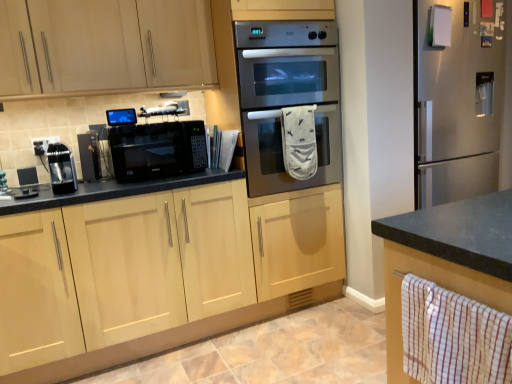
Question: From the image's perspective, is light wood cabinet at upper left, placed as the 1th cabinetry when sorted from top to bottom, over black plastic electric outlet at upper left?

Choices:
 (A) no
 (B) yes

Answer: (B)

Question: From the image's perspective, would you say light wood cabinet at upper left, which is counted as the 2th cabinetry, starting from the bottom, is shown under black plastic electric outlet at upper left?

Choices:
 (A) no
 (B) yes

Answer: (A)

Question: Can we say light wood cabinet at upper left, placed as the 1th cabinetry when sorted from top to bottom, lies outside black plastic electric outlet at upper left?

Choices:
 (A) no
 (B) yes

Answer: (B)

Question: Does light wood cabinet at upper left, which is counted as the 2th cabinetry, starting from the bottom, lie in front of black plastic electric outlet at upper left?

Choices:
 (A) yes
 (B) no

Answer: (A)

Question: Could you tell me if light wood cabinet at upper left, which is counted as the 2th cabinetry, starting from the bottom, is turned towards black plastic electric outlet at upper left?

Choices:
 (A) no
 (B) yes

Answer: (A)

Question: Visually, is white checkered hand towel at lower right, which is the 1th hand towel from bottom to top, positioned to the left or to the right of satin black coffee maker at left, placed as the 3th appliance when sorted from right to left?

Choices:
 (A) left
 (B) right

Answer: (B)

Question: From the image's perspective, relative to satin black coffee maker at left, acting as the first appliance starting from the left, is white checkered hand towel at lower right, the 2th hand towel from the top, above or below?

Choices:
 (A) below
 (B) above

Answer: (A)

Question: In terms of size, does white checkered hand towel at lower right, which is the second hand towel in back-to-front order, appear bigger or smaller than satin black coffee maker at left, placed as the 3th appliance when sorted from right to left?

Choices:
 (A) big
 (B) small

Answer: (A)

Question: Is white checkered hand towel at lower right, the first hand towel when ordered from right to left, inside the boundaries of satin black coffee maker at left, acting as the first appliance starting from the left, or outside?

Choices:
 (A) outside
 (B) inside

Answer: (A)

Question: Is satin black coffee maker at left, placed as the 3th appliance when sorted from right to left, taller or shorter than black matte coffee maker at left, positioned as the second appliance in left-to-right order?

Choices:
 (A) tall
 (B) short

Answer: (B)

Question: Looking at the image, does satin black coffee maker at left, acting as the first appliance starting from the left, seem bigger or smaller compared to black matte coffee maker at left, the second appliance positioned from the right?

Choices:
 (A) big
 (B) small

Answer: (A)

Question: From the image's perspective, relative to black matte coffee maker at left, positioned as the second appliance in left-to-right order, is satin black coffee maker at left, acting as the first appliance starting from the left, above or below?

Choices:
 (A) above
 (B) below

Answer: (B)

Question: Which is correct: satin black coffee maker at left, acting as the first appliance starting from the left, is inside black matte coffee maker at left, positioned as the second appliance in left-to-right order, or outside of it?

Choices:
 (A) inside
 (B) outside

Answer: (B)

Question: Considering the positions of satin black microwave at center and light wood cabinet at upper left, placed as the 1th cabinetry when sorted from top to bottom, in the image, is satin black microwave at center bigger or smaller than light wood cabinet at upper left, placed as the 1th cabinetry when sorted from top to bottom,?

Choices:
 (A) small
 (B) big

Answer: (B)

Question: In the image, is satin black microwave at center on the left side or the right side of light wood cabinet at upper left, placed as the 1th cabinetry when sorted from top to bottom?

Choices:
 (A) left
 (B) right

Answer: (B)